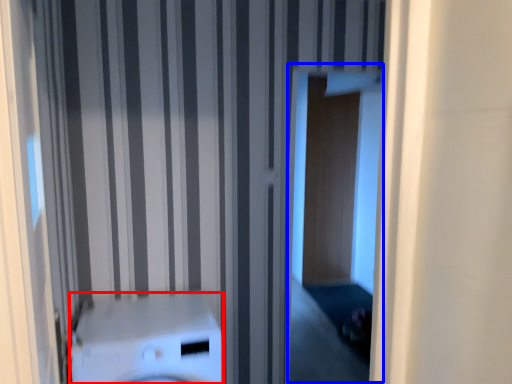
Question: Which object is further to the camera taking this photo, washer (highlighted by a red box) or screen door (highlighted by a blue box)?

Choices:
 (A) washer
 (B) screen door

Answer: (B)